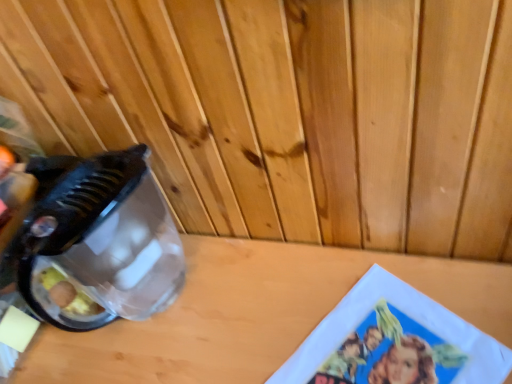
Question: Would you say wooden table at center is inside or outside transparent plastic blender at left?

Choices:
 (A) outside
 (B) inside

Answer: (A)

Question: Relative to transparent plastic blender at left, is wooden table at center in front or behind?

Choices:
 (A) front
 (B) behind

Answer: (A)

Question: Is wooden table at center wider or thinner than transparent plastic blender at left?

Choices:
 (A) thin
 (B) wide

Answer: (B)

Question: From a real-world perspective, is transparent plastic blender at left positioned above or below wooden table at center?

Choices:
 (A) below
 (B) above

Answer: (B)

Question: Is transparent plastic blender at left in front of or behind wooden table at center in the image?

Choices:
 (A) front
 (B) behind

Answer: (B)

Question: Considering the positions of transparent plastic blender at left and wooden table at center in the image, is transparent plastic blender at left wider or thinner than wooden table at center?

Choices:
 (A) wide
 (B) thin

Answer: (B)

Question: Considering the positions of transparent plastic blender at left and wooden table at center in the image, is transparent plastic blender at left bigger or smaller than wooden table at center?

Choices:
 (A) big
 (B) small

Answer: (B)